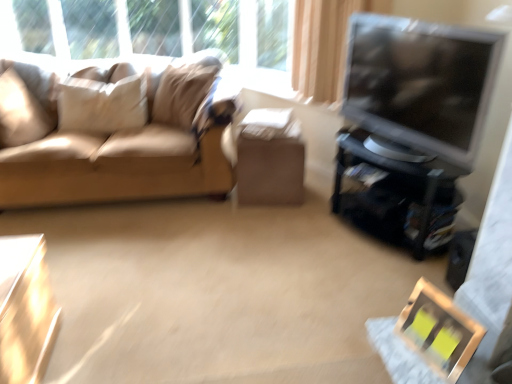
The height and width of the screenshot is (384, 512). I want to click on free point above smooth beige carpet at center (from a real-world perspective), so coord(200,262).